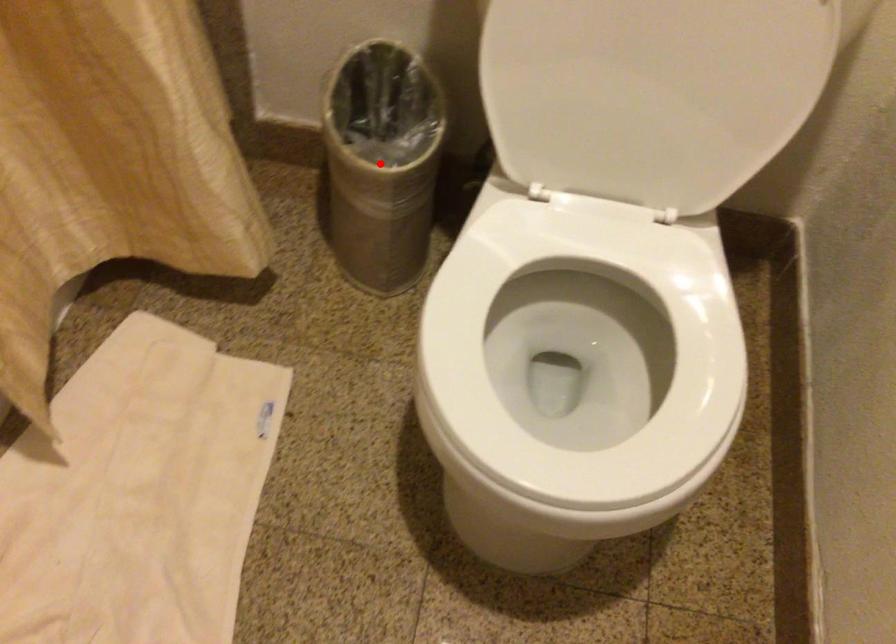
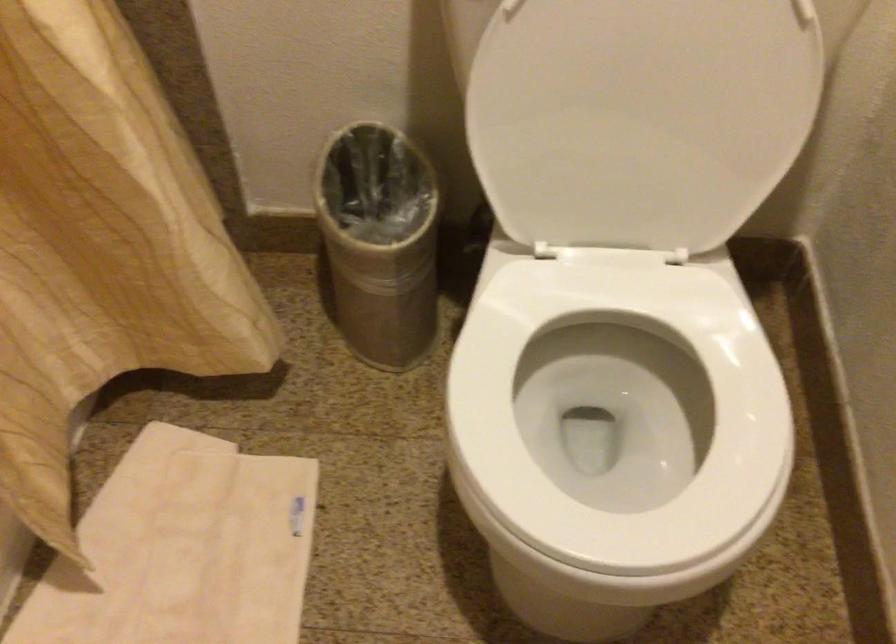
Where in the second image is the point corresponding to the highlighted location from the first image?

(380, 242)